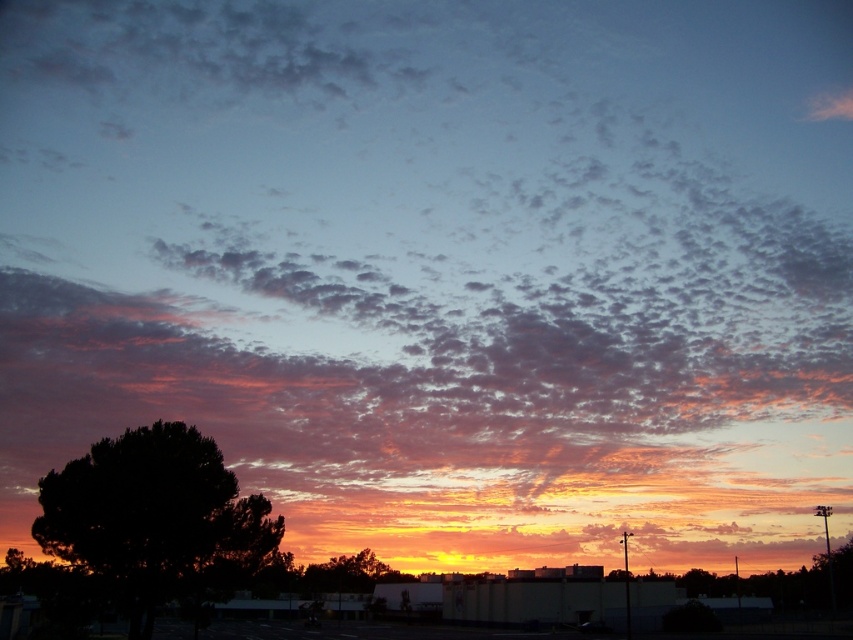
Between dark green leafy tree at lower left and green leafy tree at center, which one is positioned lower?

green leafy tree at center is below.

Does dark green leafy tree at lower left have a lesser width compared to green leafy tree at center?

Indeed, dark green leafy tree at lower left has a lesser width compared to green leafy tree at center.

Does point (280, 531) come farther from viewer compared to point (318, 573)?

No, (280, 531) is closer to viewer.

You are a GUI agent. You are given a task and a screenshot of the screen. Output one action in this format:
    pyautogui.click(x=<x>, y=<y>)
    Task: Click on the dark green leafy tree at lower left
    This screenshot has height=640, width=853.
    Given the screenshot: What is the action you would take?
    [155, 522]